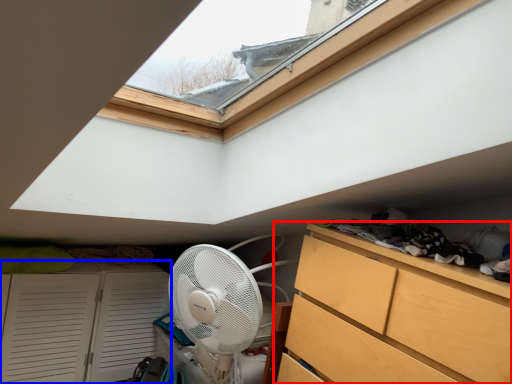
Question: Which point is closer to the camera, chest of drawers (highlighted by a red box) or cupboard (highlighted by a blue box)?

Choices:
 (A) chest of drawers
 (B) cupboard

Answer: (A)